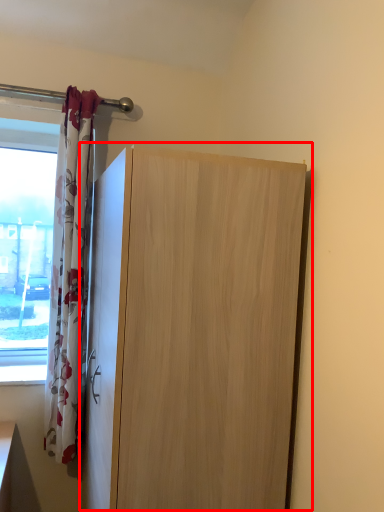
Question: From the image's perspective, where is cupboard (annotated by the red box) located in relation to curtain in the image?

Choices:
 (A) above
 (B) below

Answer: (B)